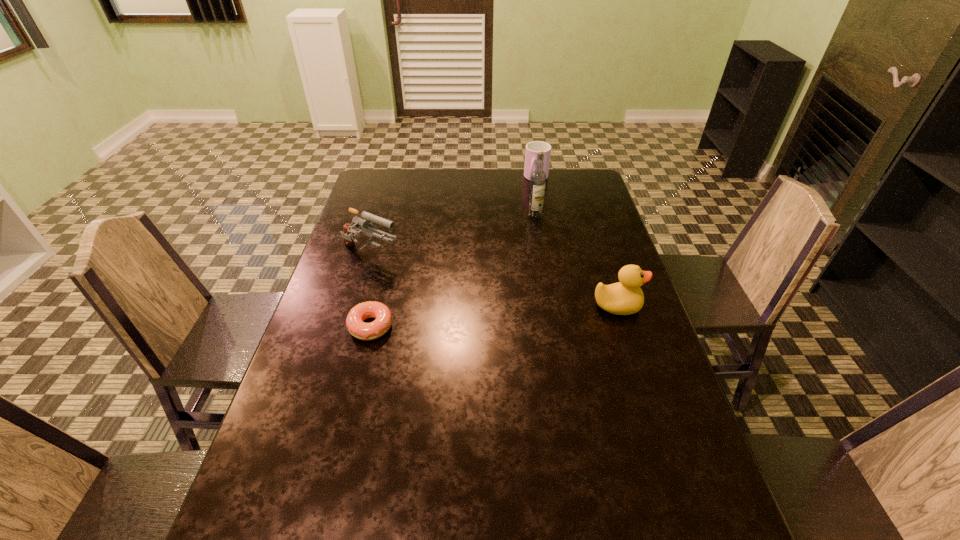
You are a GUI agent. You are given a task and a screenshot of the screen. Output one action in this format:
    pyautogui.click(x=<x>, y=<y>)
    Task: Click on the vacant space situated at the barrel end of the gun
    
    Given the screenshot: What is the action you would take?
    pyautogui.click(x=450, y=286)

At what (x,y) coordinates should I click in order to perform the action: click on vacant space located 0.230m at the barrel end of the gun. Please return your answer as a coordinate pair (x, y). Looking at the image, I should click on (459, 289).

Where is `free space located at the barrel end of the gun`? Image resolution: width=960 pixels, height=540 pixels. free space located at the barrel end of the gun is located at coordinates (498, 306).

Where is `blank space located 0.150m with the handle on the side of the farthest object`? The image size is (960, 540). blank space located 0.150m with the handle on the side of the farthest object is located at coordinates (523, 207).

Identify the location of free space located with the handle on the side of the farthest object. This screenshot has height=540, width=960. (530, 193).

The image size is (960, 540). What are the coordinates of `free space located 0.230m with the handle on the side of the farthest object` in the screenshot? It's located at (517, 219).

The width and height of the screenshot is (960, 540). In order to click on object located at the far edge in this screenshot , I will do `click(532, 148)`.

This screenshot has width=960, height=540. What are the coordinates of `doughnut that is at the left edge` in the screenshot? It's located at (364, 331).

You are a GUI agent. You are given a task and a screenshot of the screen. Output one action in this format:
    pyautogui.click(x=<x>, y=<y>)
    Task: Click on the gun positioned at the left edge
    This screenshot has height=540, width=960.
    Given the screenshot: What is the action you would take?
    pyautogui.click(x=366, y=221)

Where is `object that is positioned at the right edge`? object that is positioned at the right edge is located at coordinates (x=625, y=297).